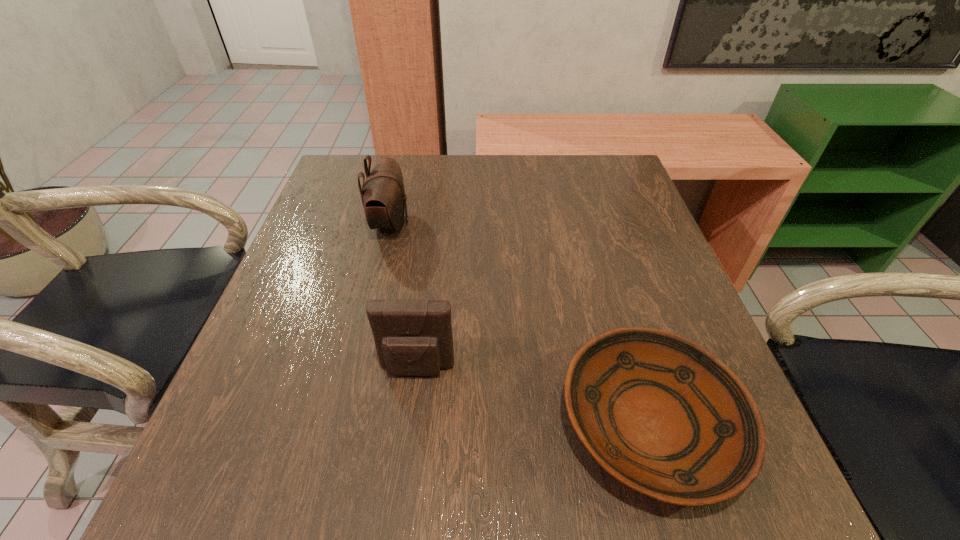
Find the location of a particular element. unoccupied position between the farther pouch and the plate is located at coordinates (520, 323).

Locate an element on the screen. The image size is (960, 540). vacant space that's between the farthest object and the nearer pouch is located at coordinates (403, 296).

This screenshot has height=540, width=960. What are the coordinates of `vacant area between the plate and the farthest object` in the screenshot? It's located at coord(520,323).

In order to click on free space between the farthest object and the shortest object in this screenshot , I will do `click(520, 323)`.

Identify the location of free point between the shortest object and the farther pouch. (520, 323).

You are a GUI agent. You are given a task and a screenshot of the screen. Output one action in this format:
    pyautogui.click(x=<x>, y=<y>)
    Task: Click on the vacant area that lies between the plate and the nearer pouch
    The width and height of the screenshot is (960, 540).
    Given the screenshot: What is the action you would take?
    pyautogui.click(x=534, y=396)

In order to click on vacant space in between the nearer pouch and the plate in this screenshot , I will do `click(534, 396)`.

Where is `free spot between the nearer pouch and the farthest object`? This screenshot has width=960, height=540. free spot between the nearer pouch and the farthest object is located at coordinates (403, 296).

Identify the location of free space that is in between the nearer pouch and the shortest object. (534, 396).

Find the location of a particular element. The width and height of the screenshot is (960, 540). the second closest object to the nearer pouch is located at coordinates (383, 196).